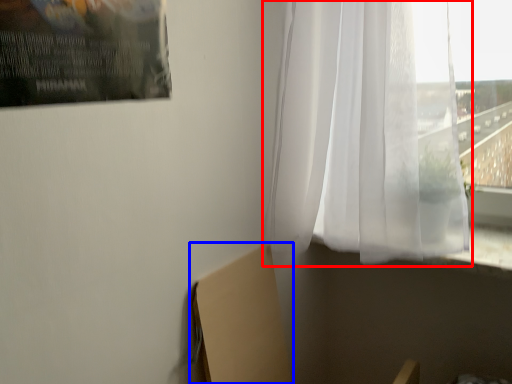
Question: Among these objects, which one is farthest to the camera, curtain (highlighted by a red box) or cardboard box (highlighted by a blue box)?

Choices:
 (A) curtain
 (B) cardboard box

Answer: (B)